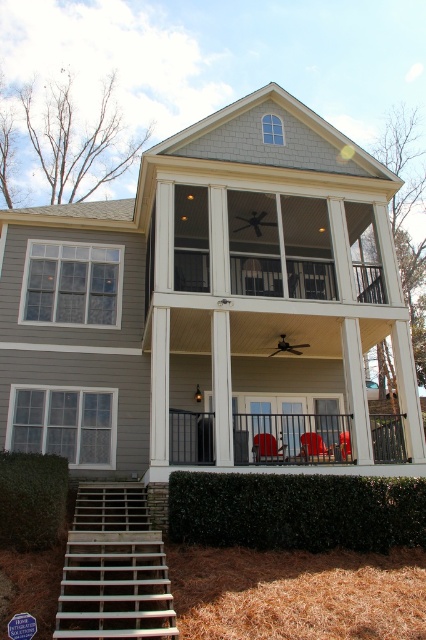
Is wooden stairs at lower left to the right of metallic black railing at center from the viewer's perspective?

In fact, wooden stairs at lower left is to the left of metallic black railing at center.

Can you confirm if wooden stairs at lower left is wider than metallic black railing at center?

Indeed, wooden stairs at lower left has a greater width compared to metallic black railing at center.

Where is `wooden stairs at lower left`? The image size is (426, 640). wooden stairs at lower left is located at coordinates (114, 570).

At what (x,y) coordinates should I click in order to perform the action: click on wooden stairs at lower left. Please return your answer as a coordinate pair (x, y). The width and height of the screenshot is (426, 640). Looking at the image, I should click on (114, 570).

Who is taller, metallic black railing at center or matte red plastic chair at center?

Standing taller between the two is matte red plastic chair at center.

From the picture: Does metallic black railing at center appear on the left side of matte red plastic chair at center?

No, metallic black railing at center is not to the left of matte red plastic chair at center.

At what (x,y) coordinates should I click in order to perform the action: click on metallic black railing at center. Please return your answer as a coordinate pair (x, y). Looking at the image, I should click on (291, 438).

Which is more to the right, dark green hedge at lower center or matte red plastic chair at center?

Positioned to the right is matte red plastic chair at center.

Does dark green hedge at lower center come in front of matte red plastic chair at center?

That is True.

Between point (233, 524) and point (302, 451), which one is positioned behind?

Positioned behind is point (302, 451).

Where is `dark green hedge at lower center`? dark green hedge at lower center is located at coordinates click(296, 509).